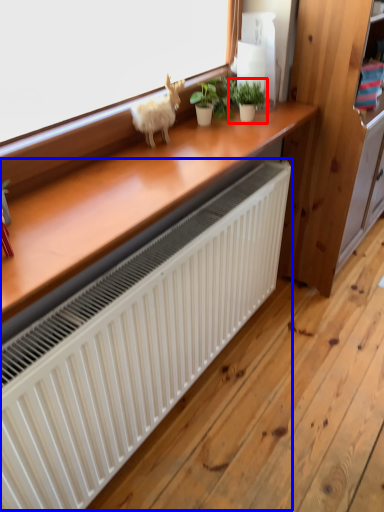
Question: Which point is closer to the camera, houseplant (highlighted by a red box) or radiator (highlighted by a blue box)?

Choices:
 (A) houseplant
 (B) radiator

Answer: (B)